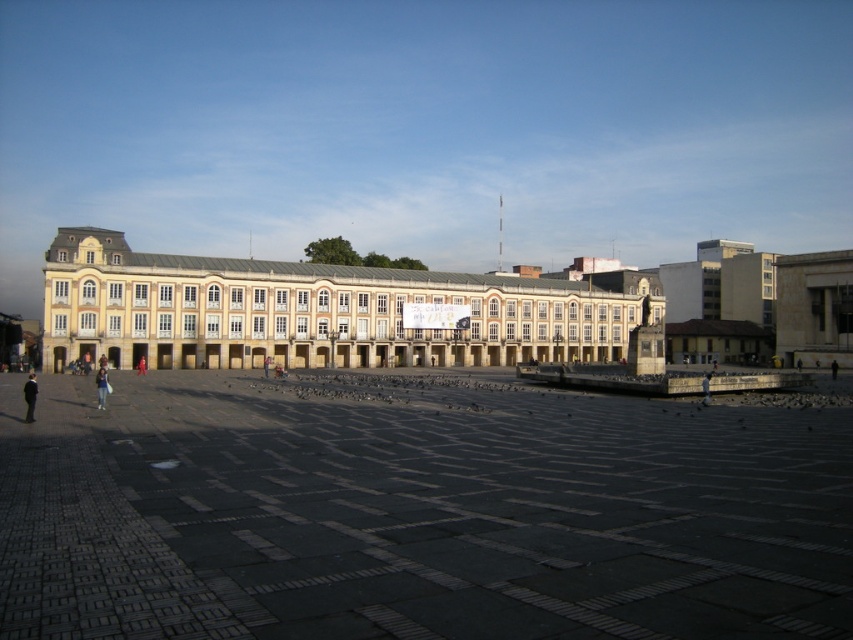
Question: Which point appears closest to the camera in this image?

Choices:
 (A) (27, 388)
 (B) (189, 323)

Answer: (A)

Question: Which point is farther to the camera?

Choices:
 (A) red fabric person at center
 (B) beige stone building at center
 (C) dark blue jeans at center
 (D) dark gray stone pavement at center

Answer: (A)

Question: Does dark gray suit at lower left appear over dark blue jeans at center?

Choices:
 (A) no
 (B) yes

Answer: (A)

Question: Where is dark blue jeans at center located in relation to red fabric person at center in the image?

Choices:
 (A) left
 (B) right

Answer: (A)

Question: Can you confirm if dark gray suit at lower left is wider than red fabric person at center?

Choices:
 (A) yes
 (B) no

Answer: (A)

Question: Which of the following is the farthest from the observer?

Choices:
 (A) beige stone building at center
 (B) dark gray stone pavement at center

Answer: (A)